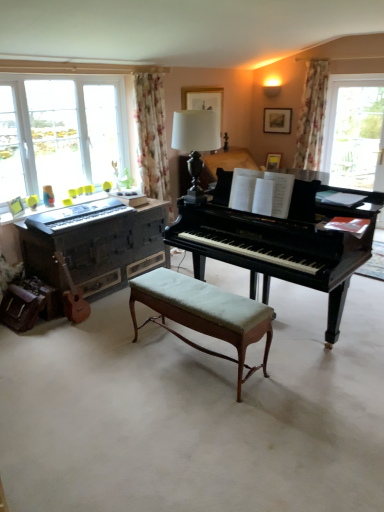
Question: From a real-world perspective, is matte black keyboard at left beneath wooden piano at left, the second piano positioned from the right?

Choices:
 (A) no
 (B) yes

Answer: (A)

Question: Is the surface of matte black keyboard at left in direct contact with wooden piano at left, the second piano positioned from the right?

Choices:
 (A) yes
 (B) no

Answer: (B)

Question: From the image's perspective, would you say matte black keyboard at left is shown under wooden piano at left, the second piano positioned from the right?

Choices:
 (A) no
 (B) yes

Answer: (A)

Question: Is matte black keyboard at left to the left of wooden piano at left, the second piano positioned from the right, from the viewer's perspective?

Choices:
 (A) no
 (B) yes

Answer: (B)

Question: Is matte black keyboard at left positioned with its back to wooden piano at left, the second piano positioned from the right?

Choices:
 (A) yes
 (B) no

Answer: (B)

Question: From a real-world perspective, is wooden acoustic guitar at lower left positioned above or below matte black keyboard at left?

Choices:
 (A) below
 (B) above

Answer: (A)

Question: Which is correct: wooden acoustic guitar at lower left is inside matte black keyboard at left, or outside of it?

Choices:
 (A) outside
 (B) inside

Answer: (A)

Question: Is wooden acoustic guitar at lower left bigger or smaller than matte black keyboard at left?

Choices:
 (A) small
 (B) big

Answer: (A)

Question: Would you say wooden acoustic guitar at lower left is to the left or to the right of matte black keyboard at left in the picture?

Choices:
 (A) left
 (B) right

Answer: (A)

Question: Would you say white glossy table lamp at center is to the left or to the right of light green upholstered bench at center in the picture?

Choices:
 (A) right
 (B) left

Answer: (A)

Question: From a real-world perspective, is white glossy table lamp at center above or below light green upholstered bench at center?

Choices:
 (A) below
 (B) above

Answer: (B)

Question: Based on their sizes in the image, would you say white glossy table lamp at center is bigger or smaller than light green upholstered bench at center?

Choices:
 (A) big
 (B) small

Answer: (B)

Question: From the image's perspective, relative to light green upholstered bench at center, is white glossy table lamp at center above or below?

Choices:
 (A) below
 (B) above

Answer: (B)

Question: Choose the correct answer: Is white glossy table lamp at center inside matte black keyboard at left or outside it?

Choices:
 (A) inside
 (B) outside

Answer: (B)

Question: In terms of width, does white glossy table lamp at center look wider or thinner when compared to matte black keyboard at left?

Choices:
 (A) thin
 (B) wide

Answer: (B)